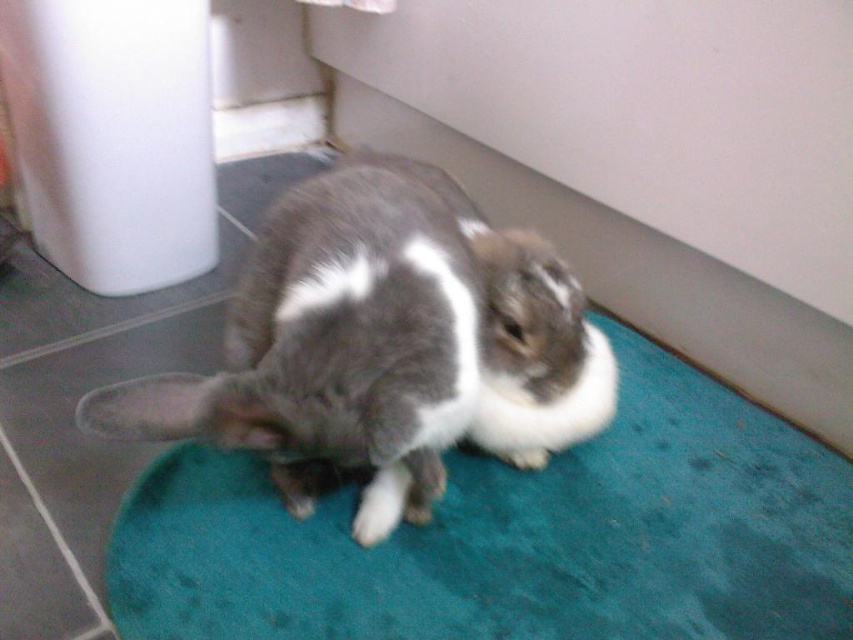
You are a pet sitter who needs to clean the area around the gray soft fur rabbit at center and the teal carpet at center. Which object should you clean first if you want to avoid disturbing the rabbit?

You should clean the teal carpet at center first because the gray soft fur rabbit at center is behind it, so cleaning the carpet first will avoid disturbing the rabbit.

You are a pet owner who wants to buy a new pet bed for your rabbits. The bed you found is designed to fit rabbits up to the size of the gray soft fur rabbit at center. Do you think the gray and white fur rabbit at center will fit comfortably in this bed?

The gray soft fur rabbit at center is bigger than the gray and white fur rabbit at center. Since the bed is designed for rabbits up to the size of the gray soft fur rabbit at center, the gray and white fur rabbit at center should fit comfortably in the bed.